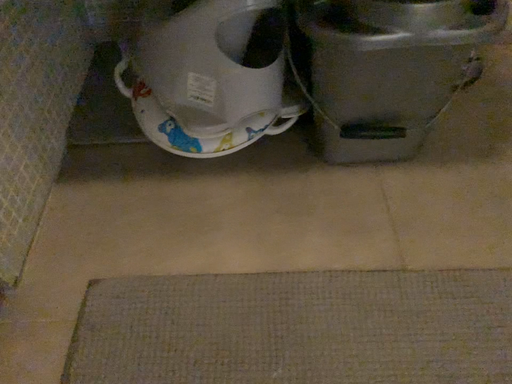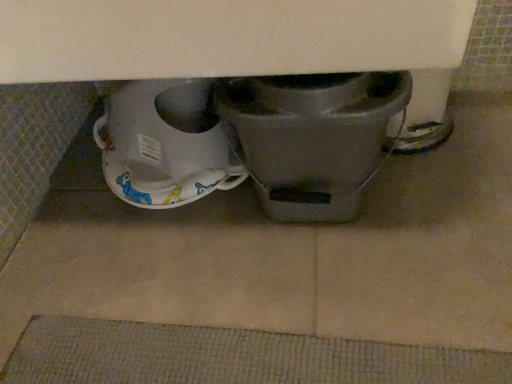
Question: Which way did the camera rotate in the video?

Choices:
 (A) rotated right
 (B) rotated left

Answer: (B)